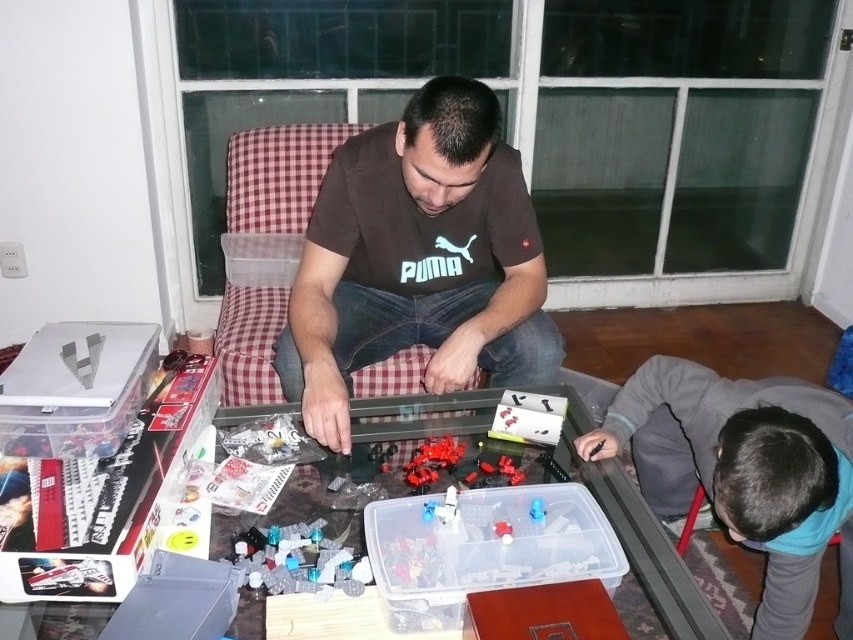
Based on the photo, between gray fleece jacket at lower right and translucent plastic pieces at lower left, which one has more height?

gray fleece jacket at lower right

Does gray fleece jacket at lower right have a lesser height compared to translucent plastic pieces at lower left?

Incorrect, gray fleece jacket at lower right's height does not fall short of translucent plastic pieces at lower left's.

Who is more forward, (810, 598) or (289, 554)?

Point (289, 554)

You are a GUI agent. You are given a task and a screenshot of the screen. Output one action in this format:
    pyautogui.click(x=<x>, y=<y>)
    Task: Click on the gray fleece jacket at lower right
    Image resolution: width=853 pixels, height=640 pixels.
    Given the screenshot: What is the action you would take?
    pyautogui.click(x=746, y=472)

Who is shorter, brown cotton shirt at center or gray fleece jacket at lower right?

Standing shorter between the two is gray fleece jacket at lower right.

Which is more to the left, brown cotton shirt at center or gray fleece jacket at lower right?

brown cotton shirt at center

Who is more forward, [340,294] or [735,464]?

Point [735,464]

Find the location of `brown cotton shirt at center`. brown cotton shirt at center is located at coordinates (418, 260).

Which is above, brown cotton shirt at center or translucent plastic pieces at lower left?

brown cotton shirt at center is higher up.

Can you confirm if brown cotton shirt at center is positioned below translucent plastic pieces at lower left?

No.

You are a GUI agent. You are given a task and a screenshot of the screen. Output one action in this format:
    pyautogui.click(x=<x>, y=<y>)
    Task: Click on the brown cotton shirt at center
    
    Given the screenshot: What is the action you would take?
    pyautogui.click(x=418, y=260)